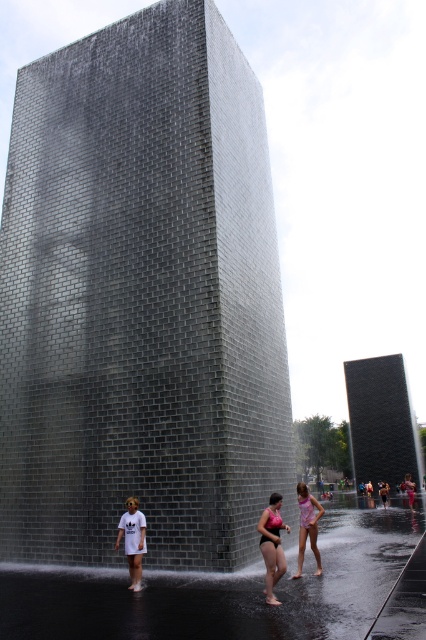
Question: Can you confirm if clear water at lower center is positioned to the left of pink fabric swimsuit at lower center?

Choices:
 (A) no
 (B) yes

Answer: (B)

Question: Which object appears closest to the camera in this image?

Choices:
 (A) pink fabric swimsuit at lower center
 (B) clear water at lower center
 (C) pink matte swimsuit at center
 (D) white matte t-shirt at lower center

Answer: (B)

Question: Which point is closer to the camera?

Choices:
 (A) pink fabric swimsuit at lower center
 (B) pink matte swimsuit at center
 (C) clear water at lower center

Answer: (C)

Question: Which point is farther to the camera?

Choices:
 (A) clear water at lower center
 (B) pink matte swimsuit at center
 (C) pink fabric swimsuit at lower center
 (D) white matte t-shirt at lower center

Answer: (C)

Question: Can you confirm if pink matte swimsuit at center is bigger than pink fabric swimsuit at lower center?

Choices:
 (A) no
 (B) yes

Answer: (A)

Question: Where is pink matte swimsuit at center located in relation to white matte t-shirt at lower center in the image?

Choices:
 (A) right
 (B) left

Answer: (A)